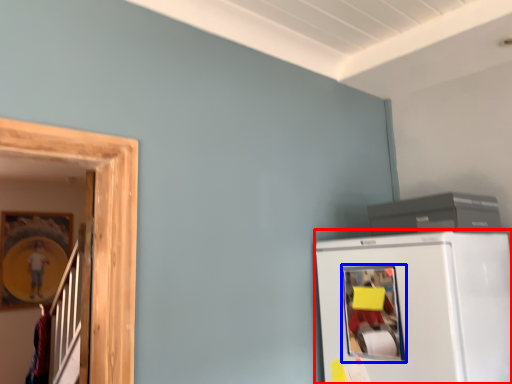
Question: Which point is closer to the camera, refrigerator (highlighted by a red box) or window (highlighted by a blue box)?

Choices:
 (A) refrigerator
 (B) window

Answer: (A)